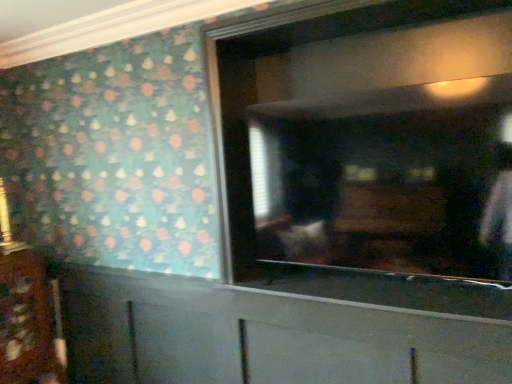
Question: Which direction should I rotate to look at white matte cabinet at lower center, the second cabinetry when ordered from left to right?

Choices:
 (A) right
 (B) left

Answer: (B)

Question: Is wooden cabinet at lower left, which is counted as the 1th cabinetry, starting from the left, surrounding white matte cabinet at lower center, which is counted as the 1th cabinetry, starting from the right?

Choices:
 (A) yes
 (B) no

Answer: (B)

Question: Can you confirm if wooden cabinet at lower left, which is counted as the 1th cabinetry, starting from the left, is positioned to the left of white matte cabinet at lower center, the second cabinetry when ordered from left to right?

Choices:
 (A) yes
 (B) no

Answer: (A)

Question: Is wooden cabinet at lower left, marked as the second cabinetry in a right-to-left arrangement, outside of white matte cabinet at lower center, which is counted as the 1th cabinetry, starting from the right?

Choices:
 (A) yes
 (B) no

Answer: (A)

Question: From the image's perspective, is wooden cabinet at lower left, which is counted as the 1th cabinetry, starting from the left, under white matte cabinet at lower center, which is counted as the 1th cabinetry, starting from the right?

Choices:
 (A) yes
 (B) no

Answer: (B)

Question: Can you see wooden cabinet at lower left, which is counted as the 1th cabinetry, starting from the left, touching white matte cabinet at lower center, the second cabinetry when ordered from left to right?

Choices:
 (A) yes
 (B) no

Answer: (B)

Question: Does wooden cabinet at lower left, marked as the second cabinetry in a right-to-left arrangement, have a smaller size compared to white matte cabinet at lower center, the second cabinetry when ordered from left to right?

Choices:
 (A) yes
 (B) no

Answer: (A)

Question: Considering the relative positions of matte glass mirror at center and wooden cabinet at lower left, marked as the second cabinetry in a right-to-left arrangement, in the image provided, is matte glass mirror at center to the right of wooden cabinet at lower left, marked as the second cabinetry in a right-to-left arrangement, from the viewer's perspective?

Choices:
 (A) yes
 (B) no

Answer: (A)

Question: Is matte glass mirror at center positioned beyond the bounds of wooden cabinet at lower left, which is counted as the 1th cabinetry, starting from the left?

Choices:
 (A) yes
 (B) no

Answer: (A)

Question: Is matte glass mirror at center turned away from wooden cabinet at lower left, marked as the second cabinetry in a right-to-left arrangement?

Choices:
 (A) no
 (B) yes

Answer: (A)

Question: Are matte glass mirror at center and wooden cabinet at lower left, marked as the second cabinetry in a right-to-left arrangement, located far from each other?

Choices:
 (A) no
 (B) yes

Answer: (B)

Question: Does matte glass mirror at center have a lesser height compared to wooden cabinet at lower left, which is counted as the 1th cabinetry, starting from the left?

Choices:
 (A) no
 (B) yes

Answer: (B)

Question: Could you tell me if matte glass mirror at center is turned towards wooden cabinet at lower left, marked as the second cabinetry in a right-to-left arrangement?

Choices:
 (A) yes
 (B) no

Answer: (B)

Question: Is white matte cabinet at lower center, the second cabinetry when ordered from left to right, turned away from matte glass mirror at center?

Choices:
 (A) yes
 (B) no

Answer: (B)